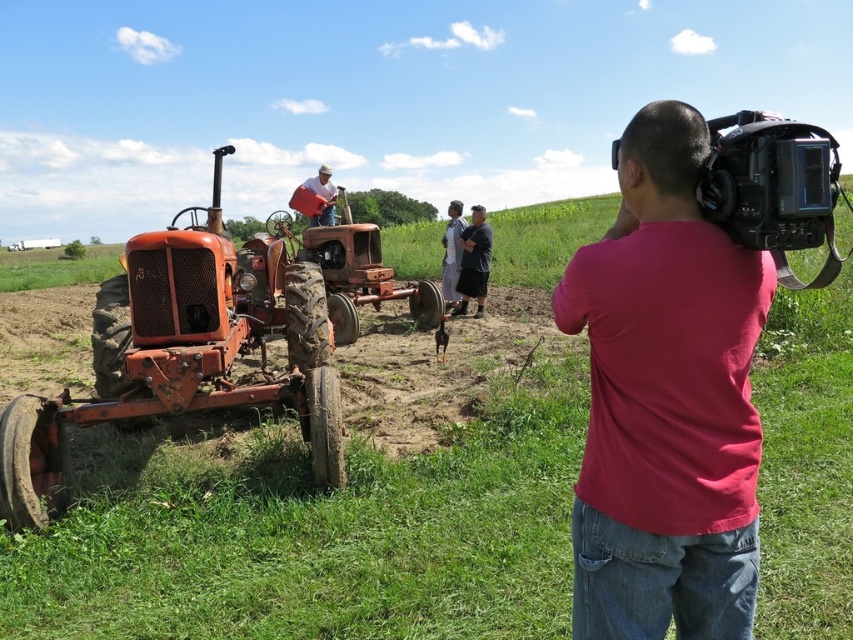
Question: Considering the real-world distances, which object is closest to the rustic metal tractor at left?

Choices:
 (A) matte orange tractor at center
 (B) dark gray fabric shirt at center
 (C) gray fabric pants at center

Answer: (B)

Question: Which object is positioned farthest from the pink cotton shirt at center?

Choices:
 (A) black matte video camera at right
 (B) dark gray fabric shirt at center
 (C) rustic metal tractor at left
 (D) rusty metal tractor at left

Answer: (B)

Question: Based on their relative distances, which object is nearer to the pink cotton shirt at center?

Choices:
 (A) gray fabric pants at center
 (B) rustic metal tractor at left
 (C) rusty metal tractor at left
 (D) matte orange tractor at center

Answer: (C)

Question: Observing the image, what is the correct spatial positioning of rustic metal tractor at left in reference to dark gray fabric shirt at center?

Choices:
 (A) below
 (B) above

Answer: (B)

Question: Considering the relative positions of gray fabric pants at center and matte orange tractor at center in the image provided, where is gray fabric pants at center located with respect to matte orange tractor at center?

Choices:
 (A) right
 (B) left

Answer: (A)

Question: Can you confirm if black matte video camera at right is bigger than matte orange tractor at center?

Choices:
 (A) yes
 (B) no

Answer: (A)